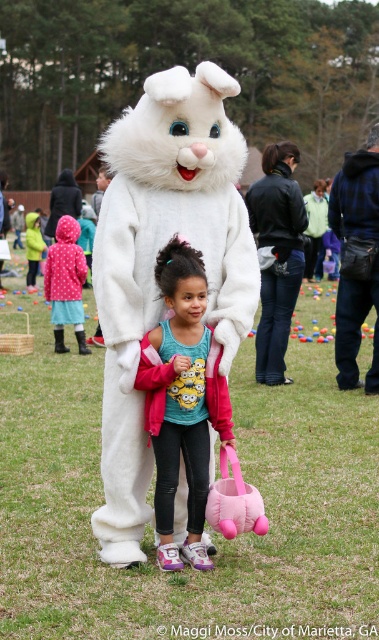
Question: Does matte pink jacket at center have a lesser width compared to pink polka dot coat at left?

Choices:
 (A) no
 (B) yes

Answer: (B)

Question: Among these points, which one is farthest from the camera?

Choices:
 (A) (84, 266)
 (B) (153, 196)
 (C) (187, 458)

Answer: (A)

Question: Can you confirm if white plush bunny at center is thinner than matte pink jacket at center?

Choices:
 (A) yes
 (B) no

Answer: (A)

Question: Is white plush bunny at center below pink polka dot coat at left?

Choices:
 (A) yes
 (B) no

Answer: (A)

Question: Which of these objects is positioned closest to the pink polka dot coat at left?

Choices:
 (A) matte pink jacket at center
 (B) white plush bunny at center

Answer: (A)

Question: Which object appears farthest from the camera in this image?

Choices:
 (A) matte pink jacket at center
 (B) white plush bunny at center

Answer: (B)